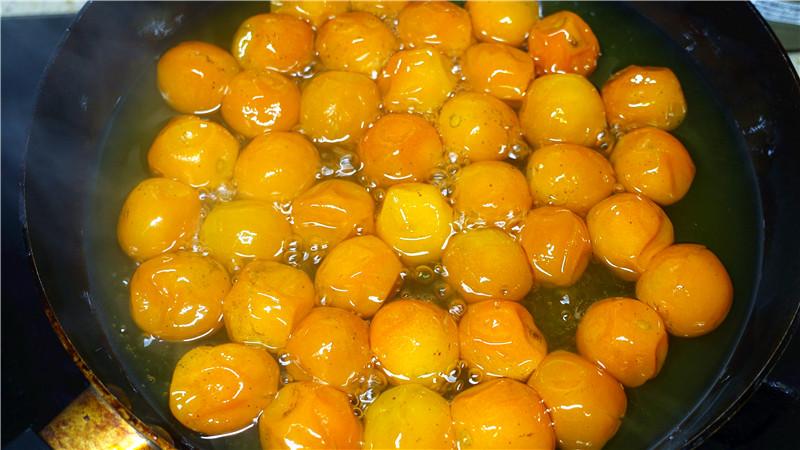
I want to click on metal handle, so click(97, 423).